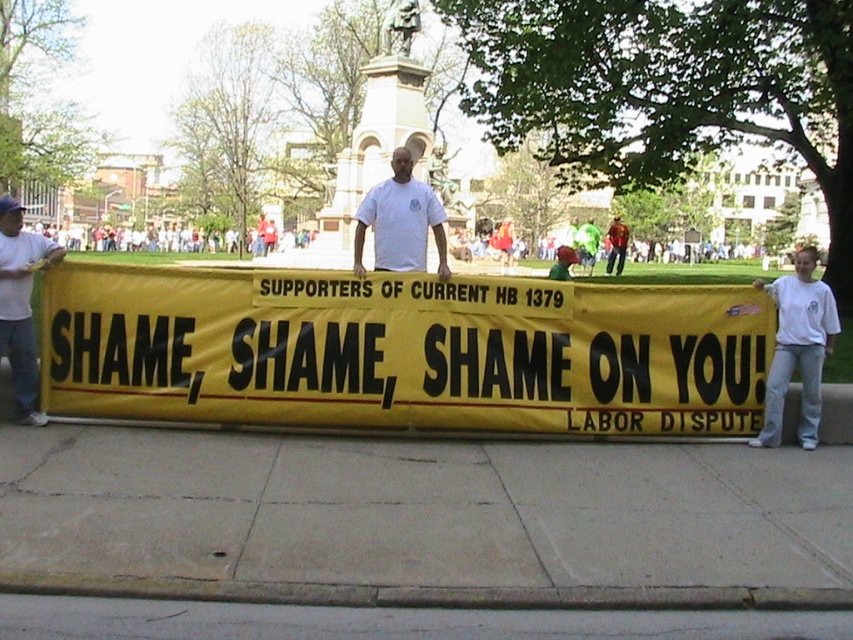
From the picture: Based on the scene description, where is the point located at coordinates [425,518]?

The point at coordinates [425,518] is located on the gray concrete sidewalk at center.